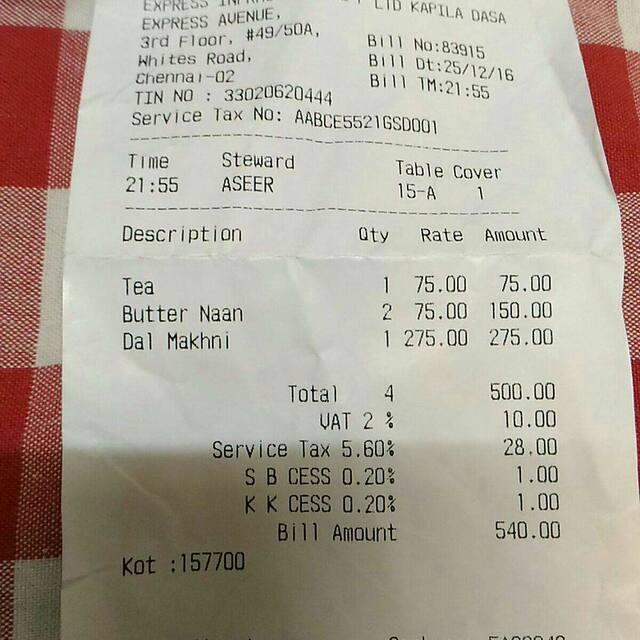
At what (x,y) coordinates should I click in order to perform the action: click on red and white fabric. Please return your answer as a coordinate pair (x, y). The image size is (640, 640). Looking at the image, I should click on (40, 160).